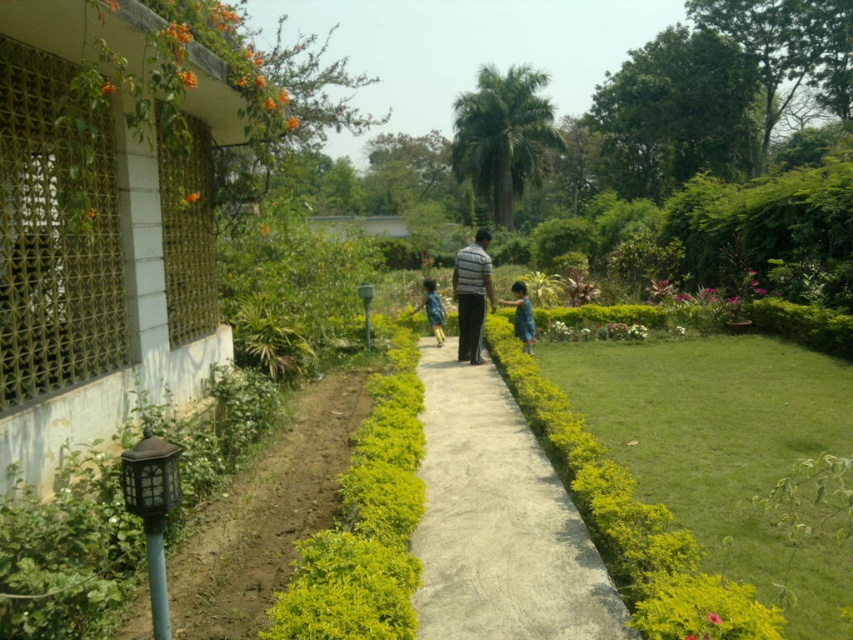
Question: Among these points, which one is nearest to the camera?

Choices:
 (A) (473, 260)
 (B) (463, 625)
 (C) (434, 333)

Answer: (B)

Question: Considering the real-world distances, which object is closest to the green matte dress at center?

Choices:
 (A) blue denim shorts at center
 (B) striped fabric man at center
 (C) smooth concrete path at center

Answer: (B)

Question: Which point is farther to the camera?

Choices:
 (A) (457, 310)
 (B) (434, 323)
 (C) (529, 310)
 (D) (471, 580)

Answer: (B)

Question: Observing the image, what is the correct spatial positioning of striped fabric man at center in reference to green matte dress at center?

Choices:
 (A) right
 (B) left

Answer: (B)

Question: Is striped fabric man at center positioned at the back of blue denim shorts at center?

Choices:
 (A) no
 (B) yes

Answer: (A)

Question: Does smooth concrete path at center appear on the right side of blue denim shorts at center?

Choices:
 (A) no
 (B) yes

Answer: (B)